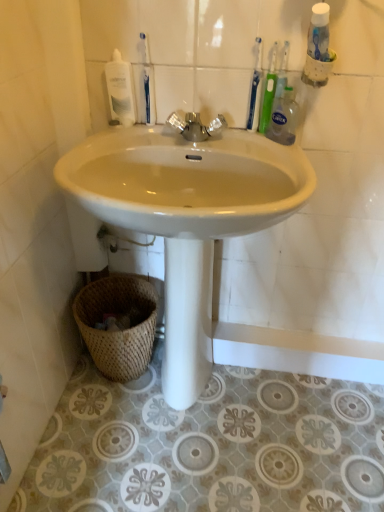
Question: From a real-world perspective, is blue plastic toothbrush at upper center, which appears as the 1th toothbrush when viewed from the left, located higher than silver metallic faucet at center?

Choices:
 (A) yes
 (B) no

Answer: (A)

Question: Is blue plastic toothbrush at upper center, which appears as the 1th toothbrush when viewed from the left, looking in the opposite direction of silver metallic faucet at center?

Choices:
 (A) yes
 (B) no

Answer: (B)

Question: Is blue plastic toothbrush at upper center, which appears as the 1th toothbrush when viewed from the left, aimed at silver metallic faucet at center?

Choices:
 (A) yes
 (B) no

Answer: (B)

Question: Considering the relative positions of blue plastic toothbrush at upper center, which appears as the third toothbrush when viewed from the right, and silver metallic faucet at center in the image provided, is blue plastic toothbrush at upper center, which appears as the third toothbrush when viewed from the right, to the right of silver metallic faucet at center from the viewer's perspective?

Choices:
 (A) no
 (B) yes

Answer: (A)

Question: Can you confirm if blue plastic toothbrush at upper center, which appears as the 1th toothbrush when viewed from the left, is bigger than silver metallic faucet at center?

Choices:
 (A) yes
 (B) no

Answer: (B)

Question: From a real-world perspective, is clear plastic bottle at upper right positioned above or below woven natural basket at lower left?

Choices:
 (A) above
 (B) below

Answer: (A)

Question: From their relative heights in the image, would you say clear plastic bottle at upper right is taller or shorter than woven natural basket at lower left?

Choices:
 (A) short
 (B) tall

Answer: (A)

Question: Is clear plastic bottle at upper right bigger or smaller than woven natural basket at lower left?

Choices:
 (A) small
 (B) big

Answer: (A)

Question: From the image's perspective, is clear plastic bottle at upper right above or below woven natural basket at lower left?

Choices:
 (A) above
 (B) below

Answer: (A)

Question: Is blue plastic toothbrush at upper center, which appears as the 1th toothbrush when viewed from the left, taller or shorter than white glossy sink at center?

Choices:
 (A) short
 (B) tall

Answer: (A)

Question: From a real-world perspective, is blue plastic toothbrush at upper center, which appears as the third toothbrush when viewed from the right, above or below white glossy sink at center?

Choices:
 (A) above
 (B) below

Answer: (A)

Question: Based on their positions, is blue plastic toothbrush at upper center, which appears as the 1th toothbrush when viewed from the left, located to the left or right of white glossy sink at center?

Choices:
 (A) left
 (B) right

Answer: (A)

Question: Considering the positions of point (145, 65) and point (225, 192), is point (145, 65) closer or farther from the camera than point (225, 192)?

Choices:
 (A) closer
 (B) farther

Answer: (A)

Question: Is clear plastic bottle at upper right in front of or behind silver metallic faucet at center in the image?

Choices:
 (A) behind
 (B) front

Answer: (B)

Question: From the image's perspective, is clear plastic bottle at upper right positioned above or below silver metallic faucet at center?

Choices:
 (A) below
 (B) above

Answer: (B)